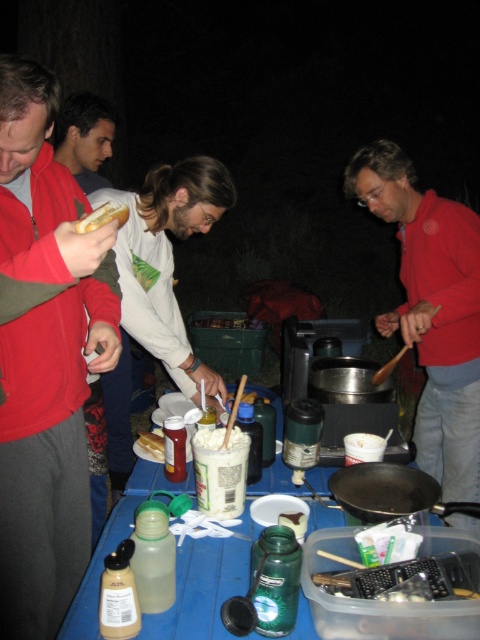
Question: Which object appears closest to the camera in this image?

Choices:
 (A) white creamy substance at center
 (B) black matte frying pan at center
 (C) matte red jacket at left
 (D) matte red jacket at center

Answer: (C)

Question: Which of the following is the farthest from the observer?

Choices:
 (A) (231, 436)
 (B) (216, 547)
 (C) (52, 620)

Answer: (C)

Question: Can you confirm if matte red jacket at center is wider than black matte frying pan at center?

Choices:
 (A) yes
 (B) no

Answer: (A)

Question: Observing the image, what is the correct spatial positioning of matte red jacket at left in reference to black matte frying pan at center?

Choices:
 (A) above
 (B) below

Answer: (A)

Question: Which of the following is the farthest from the observer?

Choices:
 (A) (441, 476)
 (B) (199, 547)
 (C) (154, 460)
 (D) (106, 120)

Answer: (D)

Question: Is blue plastic table at center thinner than white creamy substance at center?

Choices:
 (A) no
 (B) yes

Answer: (A)